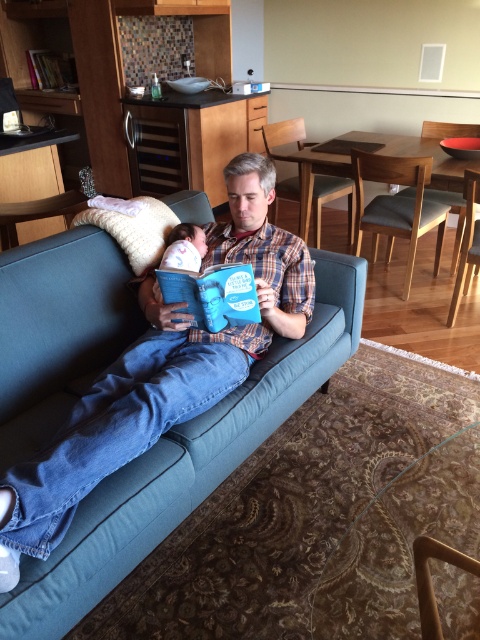
Who is more distant from viewer, (325,348) or (170,237)?

The point (325,348) is more distant.

Does blue fabric couch at center come in front of white soft baby at center?

Yes, it is in front of white soft baby at center.

Does point (73, 516) lie behind point (189, 244)?

No, (73, 516) is in front of (189, 244).

The width and height of the screenshot is (480, 640). What are the coordinates of `blue fabric couch at center` in the screenshot? It's located at (184, 465).

Is fluffy white pillow at center further to camera compared to white soft baby at center?

Yes, fluffy white pillow at center is further from the viewer.

Does fluffy white pillow at center have a greater width compared to white soft baby at center?

Yes, fluffy white pillow at center is wider than white soft baby at center.

Who is more forward, (x=145, y=232) or (x=199, y=244)?

Point (x=199, y=244)

Where is `fluffy white pillow at center`? This screenshot has height=640, width=480. fluffy white pillow at center is located at coordinates (134, 228).

Is blue fabric couch at center above fluffy white pillow at center?

No.

Is the position of blue fabric couch at center more distant than that of fluffy white pillow at center?

No, blue fabric couch at center is closer to the viewer.

Is point (58, 353) positioned before point (145, 228)?

Yes, point (58, 353) is in front of point (145, 228).

Locate an element on the screen. This screenshot has height=640, width=480. blue fabric couch at center is located at coordinates (184, 465).